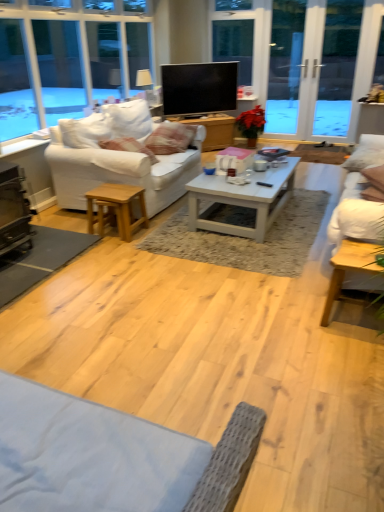
Locate an element on the screen. This screenshot has width=384, height=512. free spot in front of white painted wood coffee table at center, which is the first coffee table from top to bottom is located at coordinates (249, 245).